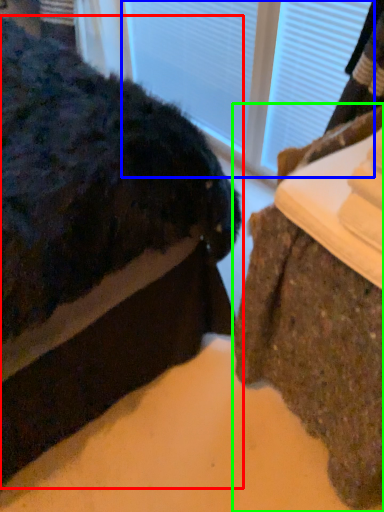
Question: Considering the real-world distances, which object is farthest from furniture (highlighted by a red box)? glass door (highlighted by a blue box) or furniture (highlighted by a green box)?

Choices:
 (A) glass door
 (B) furniture

Answer: (A)